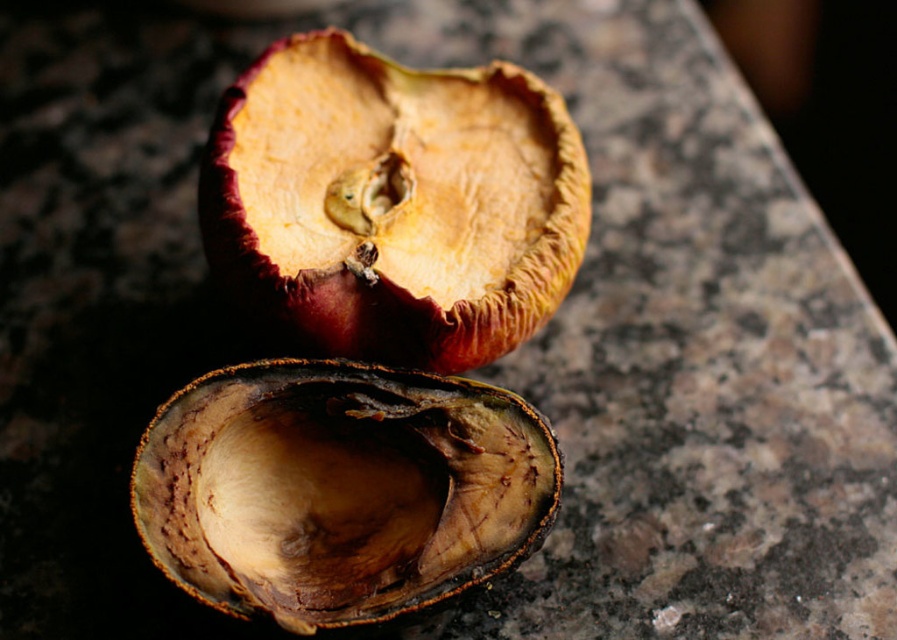
Measure the distance between brown leathery apple at upper center and brown leathery shell at center.

brown leathery apple at upper center and brown leathery shell at center are 6.82 inches apart from each other.

Can you confirm if brown leathery apple at upper center is bigger than brown leathery shell at center?

Indeed, brown leathery apple at upper center has a larger size compared to brown leathery shell at center.

Between point (422, 102) and point (347, 461), which one is positioned behind?

The point (422, 102) is more distant.

Find the location of a particular element. The image size is (897, 640). brown leathery apple at upper center is located at coordinates (393, 204).